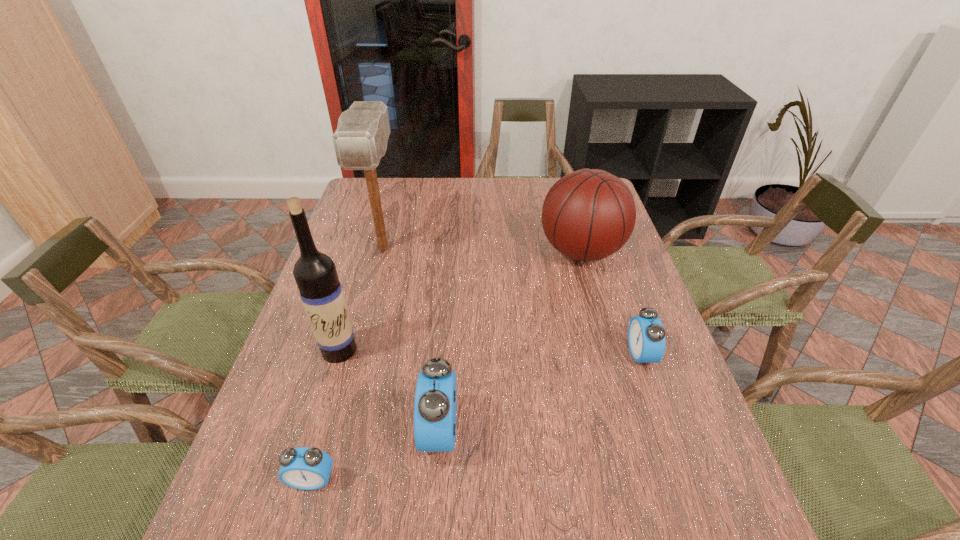
At what (x,y) coordinates should I click in order to perform the action: click on vacant region located 0.110m on the face of the third object from right to left. Please return your answer as a coordinate pair (x, y). This screenshot has width=960, height=540. Looking at the image, I should click on (369, 431).

You are a GUI agent. You are given a task and a screenshot of the screen. Output one action in this format:
    pyautogui.click(x=<x>, y=<y>)
    Task: Click on the vacant space located on the face of the third object from right to left
    
    Given the screenshot: What is the action you would take?
    tap(276, 431)

Find the location of a particular element. This screenshot has width=960, height=540. vacant space located 0.330m on the face of the second shortest alarm clock is located at coordinates (492, 354).

Locate an element on the screen. vacant space located 0.210m on the face of the second shortest alarm clock is located at coordinates (542, 354).

Locate an element on the screen. The image size is (960, 540). free space located 0.210m on the face of the second shortest alarm clock is located at coordinates (542, 354).

What are the coordinates of `free region located on the striking face of the mallet` in the screenshot? It's located at (356, 350).

Where is `free location located on the front of the basketball`? free location located on the front of the basketball is located at coordinates (601, 321).

Locate an element on the screen. vacant space located 0.290m on the label of the wine bottle is located at coordinates (297, 489).

Identify the location of alarm clock present at the left edge. (304, 468).

You are a GUI agent. You are given a task and a screenshot of the screen. Output one action in this format:
    pyautogui.click(x=<x>, y=<y>)
    Task: Click on the mallet that is at the left edge
    This screenshot has height=540, width=960.
    Given the screenshot: What is the action you would take?
    pyautogui.click(x=360, y=141)